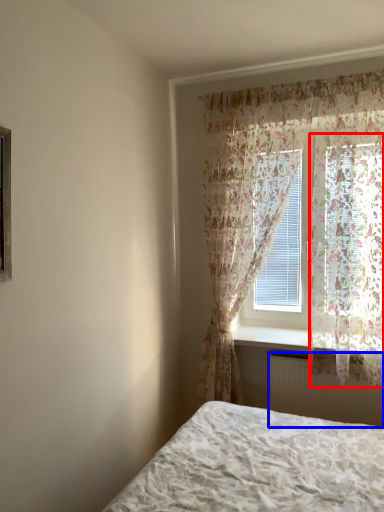
Question: Among these objects, which one is farthest to the camera, curtain (highlighted by a red box) or radiator (highlighted by a blue box)?

Choices:
 (A) curtain
 (B) radiator

Answer: (B)